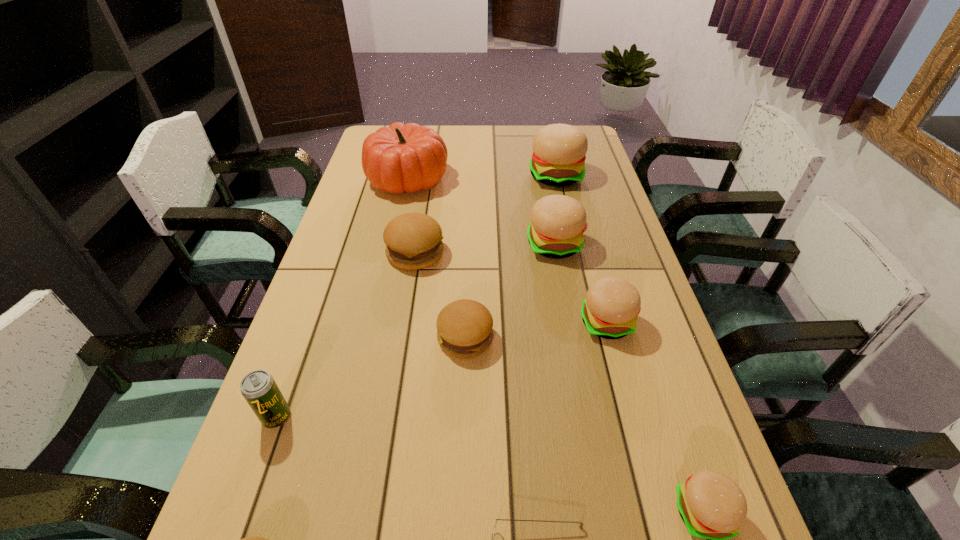
Identify the location of the second farthest brown hamburger. This screenshot has width=960, height=540. (464, 327).

Find the location of a particular element. vacant space located 0.150m on the front of the pumpkin is located at coordinates (396, 232).

This screenshot has width=960, height=540. Identify the location of free region located 0.050m on the left of the tallest hamburger. (515, 176).

Find the location of a particular element. vacant space located 0.310m on the left of the second tallest hamburger is located at coordinates (419, 245).

You are a GUI agent. You are given a task and a screenshot of the screen. Output one action in this format:
    pyautogui.click(x=<x>, y=<y>)
    Task: Click on the vacant space located on the right of the fourth nearest object
    This screenshot has width=960, height=540.
    Given the screenshot: What is the action you would take?
    pyautogui.click(x=459, y=417)

Identify the location of vacant space located 0.370m on the front of the second smallest beige hamburger. The image size is (960, 540). (659, 516).

You are a GUI agent. You are given a task and a screenshot of the screen. Output one action in this format:
    pyautogui.click(x=<x>, y=<y>)
    Task: Click on the blank space located on the front of the sixth hamburger from right to left
    This screenshot has height=540, width=960.
    Given the screenshot: What is the action you would take?
    pyautogui.click(x=405, y=318)

The image size is (960, 540). Identify the location of vacant region located on the right of the third hamburger from left to right. (578, 338).

I want to click on pumpkin present at the left edge, so click(408, 157).

Find the location of a particular element. beer can that is at the left edge is located at coordinates (259, 389).